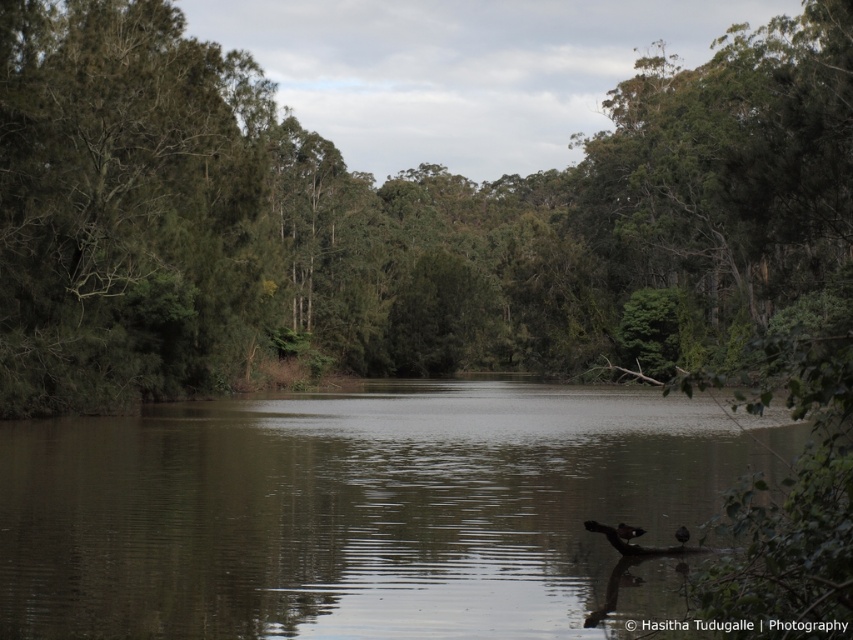
Question: Which point is closer to the camera taking this photo?

Choices:
 (A) (358, 506)
 (B) (840, 280)

Answer: (A)

Question: Is green leafy tree at center wider than greenish-brown water at center?

Choices:
 (A) yes
 (B) no

Answer: (A)

Question: Is green leafy tree at center bigger than greenish-brown water at center?

Choices:
 (A) no
 (B) yes

Answer: (B)

Question: Does green leafy tree at center appear on the left side of greenish-brown water at center?

Choices:
 (A) no
 (B) yes

Answer: (A)